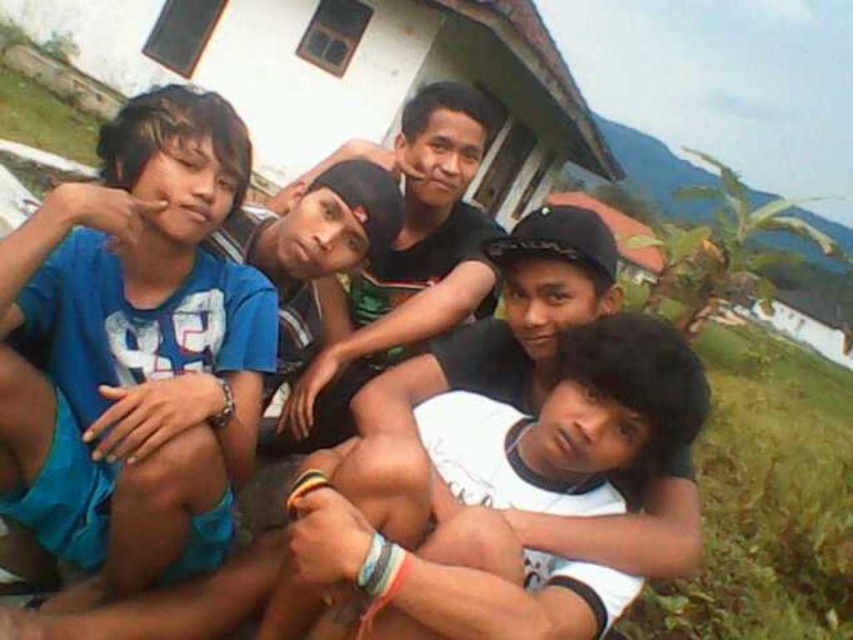
You are trying to locate the blue matte shirt at left and the white matte shirt at lower center in the image. Based on their positions, which one is closer to the left side of the image?

The blue matte shirt at left is closer to the left side of the image because it is positioned to the left of the white matte shirt at lower center.